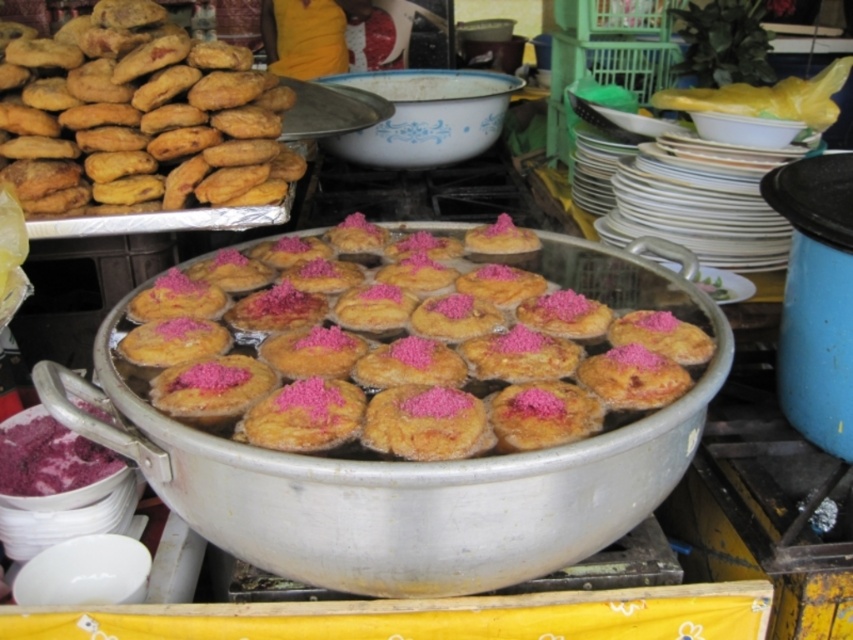
Question: Can you confirm if pink sugary treats at center is wider than purple powder at lower left?

Choices:
 (A) no
 (B) yes

Answer: (B)

Question: Which point is farther to the camera?

Choices:
 (A) (x=225, y=426)
 (B) (x=62, y=481)

Answer: (B)

Question: Which of the following is the closest to the observer?

Choices:
 (A) pink sugary treats at center
 (B) purple powder at lower left
 (C) golden fried pastry at upper left

Answer: (A)

Question: Can you confirm if pink sugary treats at center is positioned to the right of golden fried pastry at upper left?

Choices:
 (A) no
 (B) yes

Answer: (B)

Question: Which point is farther to the camera?

Choices:
 (A) golden fried pastry at upper left
 (B) purple powder at lower left
 (C) pink sugary treats at center

Answer: (A)

Question: Can you confirm if golden fried pastry at upper left is wider than purple powder at lower left?

Choices:
 (A) yes
 (B) no

Answer: (A)